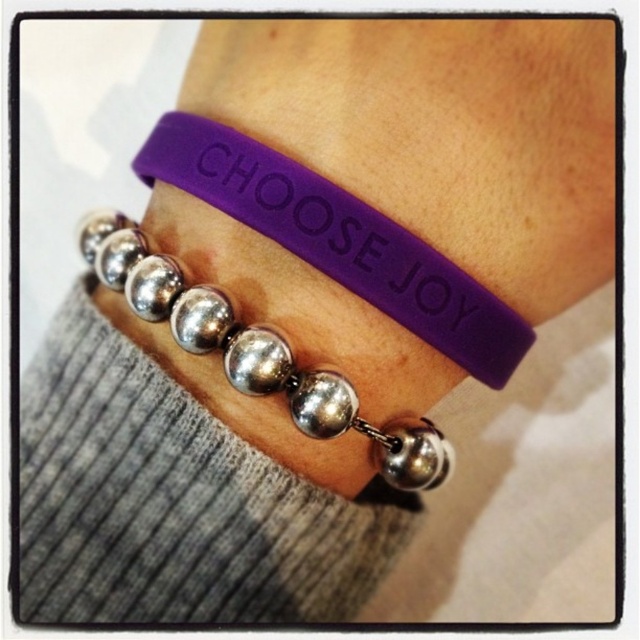
This screenshot has width=640, height=640. What do you see at coordinates (339, 241) in the screenshot? I see `purple rubber bracelet at upper center` at bounding box center [339, 241].

Can you confirm if purple rubber bracelet at upper center is positioned above silver metallic bead at center?

Yes.

The image size is (640, 640). Describe the element at coordinates (339, 241) in the screenshot. I see `purple rubber bracelet at upper center` at that location.

Image resolution: width=640 pixels, height=640 pixels. Identify the location of purple rubber bracelet at upper center. (339, 241).